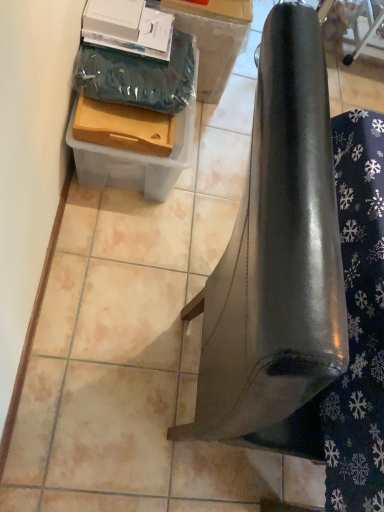
Question: Is matte plastic box at upper left, the second cardboard box viewed from the top, smaller than wooden drawer at upper left?

Choices:
 (A) no
 (B) yes

Answer: (A)

Question: Could wooden drawer at upper left be considered to be inside matte plastic box at upper left, the first cardboard box from the bottom?

Choices:
 (A) yes
 (B) no

Answer: (B)

Question: Considering the relative positions of matte plastic box at upper left, the second cardboard box viewed from the top, and wooden drawer at upper left in the image provided, is matte plastic box at upper left, the second cardboard box viewed from the top, to the right of wooden drawer at upper left from the viewer's perspective?

Choices:
 (A) no
 (B) yes

Answer: (A)

Question: Is matte plastic box at upper left, the first cardboard box from the bottom, positioned with its back to wooden drawer at upper left?

Choices:
 (A) no
 (B) yes

Answer: (A)

Question: Would you say matte plastic box at upper left, the first cardboard box from the bottom, is outside wooden drawer at upper left?

Choices:
 (A) yes
 (B) no

Answer: (A)

Question: Considering the relative sizes of matte plastic box at upper left, the second cardboard box viewed from the top, and wooden drawer at upper left in the image provided, is matte plastic box at upper left, the second cardboard box viewed from the top, wider than wooden drawer at upper left?

Choices:
 (A) yes
 (B) no

Answer: (A)

Question: Does wooden drawer at upper left turn towards cardboard box at upper left, positioned as the second cardboard box in bottom-to-top order?

Choices:
 (A) yes
 (B) no

Answer: (B)

Question: Is wooden drawer at upper left facing away from cardboard box at upper left, the first cardboard box in the top-to-bottom sequence?

Choices:
 (A) yes
 (B) no

Answer: (B)

Question: Is wooden drawer at upper left at the right side of cardboard box at upper left, positioned as the second cardboard box in bottom-to-top order?

Choices:
 (A) no
 (B) yes

Answer: (A)

Question: Is wooden drawer at upper left directly adjacent to cardboard box at upper left, positioned as the second cardboard box in bottom-to-top order?

Choices:
 (A) yes
 (B) no

Answer: (B)

Question: Is the position of wooden drawer at upper left less distant than that of cardboard box at upper left, positioned as the second cardboard box in bottom-to-top order?

Choices:
 (A) no
 (B) yes

Answer: (B)

Question: From a real-world perspective, is wooden drawer at upper left on top of cardboard box at upper left, the first cardboard box in the top-to-bottom sequence?

Choices:
 (A) yes
 (B) no

Answer: (A)

Question: Does matte plastic box at upper left, the first cardboard box from the bottom, turn towards cardboard box at upper left, the first cardboard box in the top-to-bottom sequence?

Choices:
 (A) yes
 (B) no

Answer: (B)